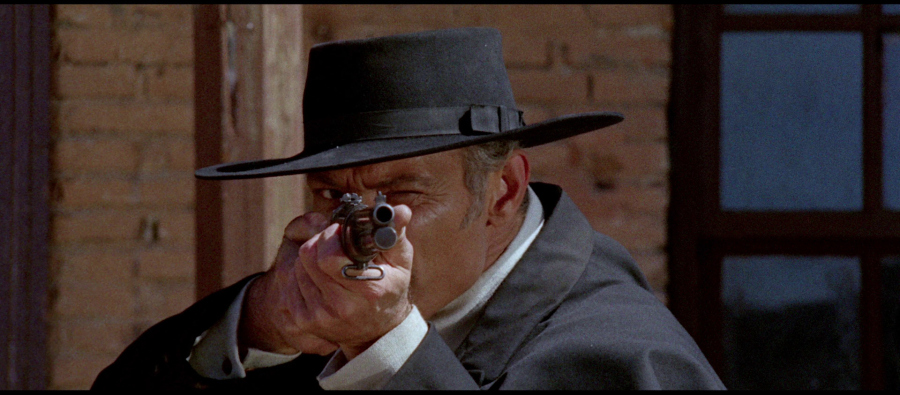
I want to click on support beam, so click(x=255, y=91).